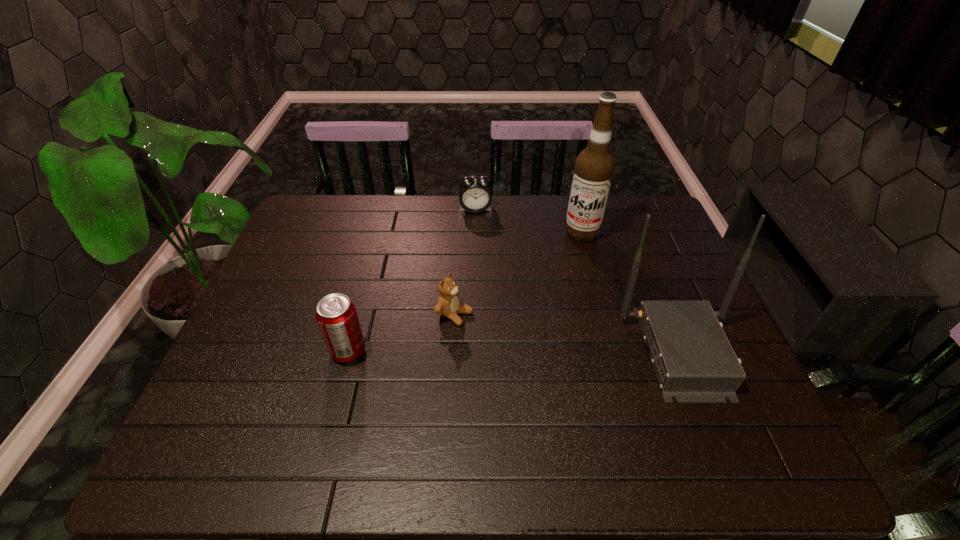
Where is `free space on the desktop that is between the third shortest object and the second tallest object and is positioned on the label of the tallest object`? free space on the desktop that is between the third shortest object and the second tallest object and is positioned on the label of the tallest object is located at coordinates (544, 352).

Where is `free spot on the desktop that is between the soda and the router and is positioned on the front side of the farthest object`? This screenshot has height=540, width=960. free spot on the desktop that is between the soda and the router and is positioned on the front side of the farthest object is located at coordinates (492, 351).

This screenshot has height=540, width=960. I want to click on free space on the desktop that is between the third tallest object and the router and is positioned on the front-facing side of the teddy bear, so click(x=536, y=352).